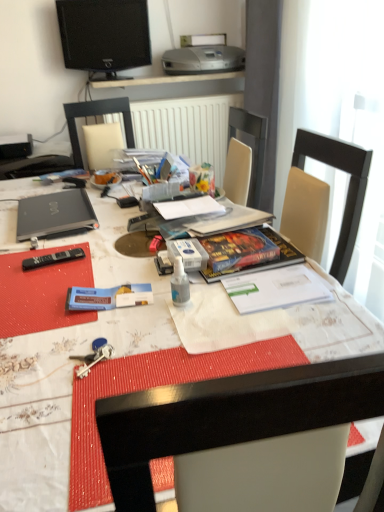
Question: From the image's perspective, relative to black matte laptop at left, is black glossy television at upper center above or below?

Choices:
 (A) above
 (B) below

Answer: (A)

Question: In terms of width, does black glossy television at upper center look wider or thinner when compared to black matte laptop at left?

Choices:
 (A) wide
 (B) thin

Answer: (B)

Question: Based on their relative distances, which object is nearer to the white glossy desk at center?

Choices:
 (A) black matte laptop at left
 (B) white paper at center
 (C) black plastic remote control at lower left
 (D) transparent plastic spray bottle at center
 (E) silver metallic printer at upper center

Answer: (A)

Question: Which is farther from the black glossy television at upper center?

Choices:
 (A) transparent plastic spray bottle at center
 (B) white paper at center
 (C) silver metallic printer at upper center
 (D) black matte laptop at left
 (E) white glossy desk at center

Answer: (A)